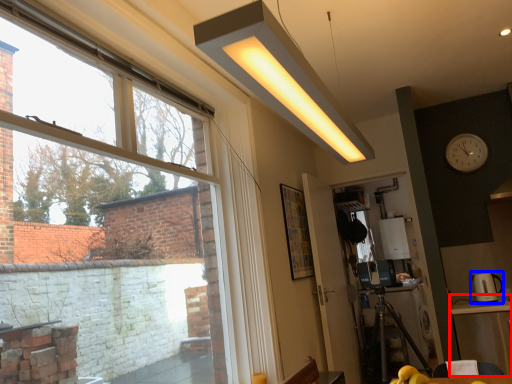
Question: Which of the following is the farthest to the observer, table (highlighted by a red box) or appliance (highlighted by a blue box)?

Choices:
 (A) table
 (B) appliance

Answer: (B)